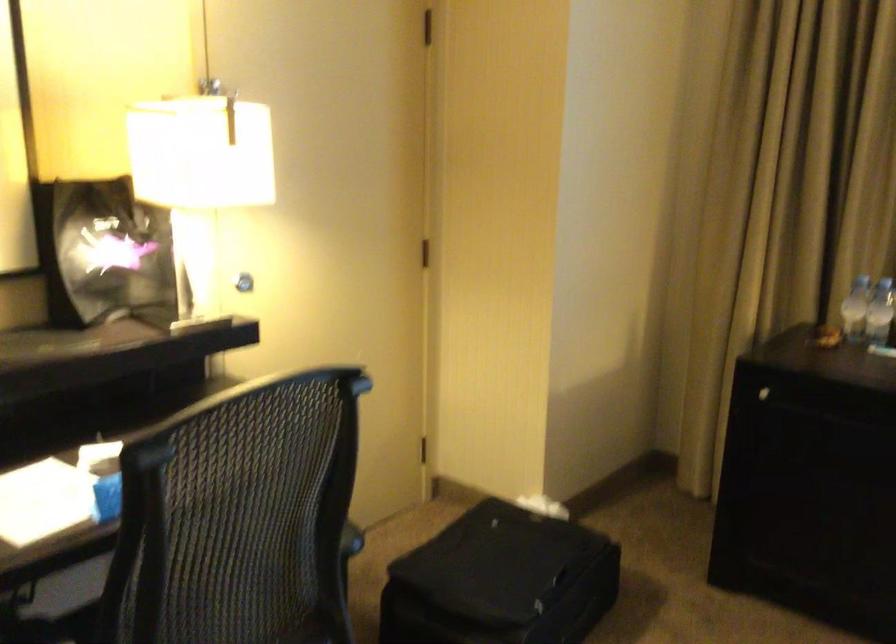
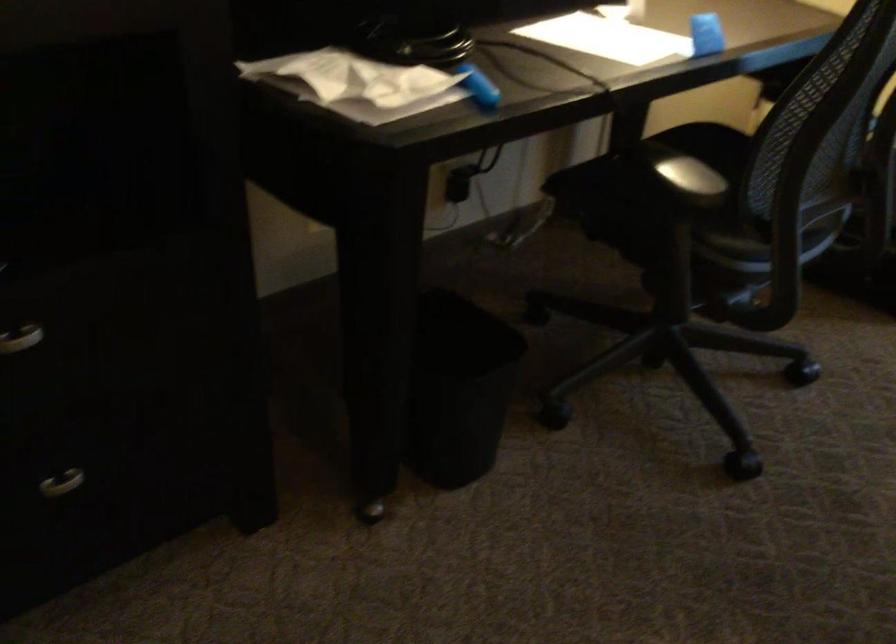
Question: Based on the continuous images, in which direction is the camera rotating? Reply with the corresponding letter.

Choices:
 (A) Left
 (B) Right
 (C) Up
 (D) Down

Answer: (D)